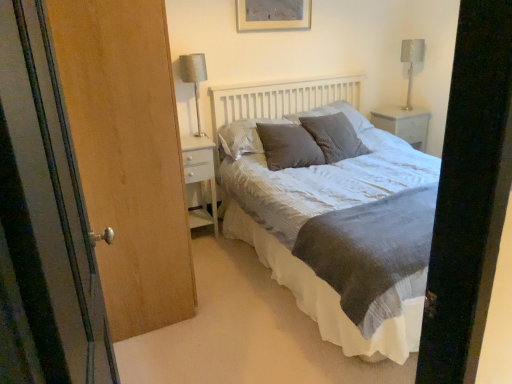
Identify the location of vacant area that is in front of white wood nightstand at left, the second nightstand viewed from the back. The height and width of the screenshot is (384, 512). (211, 255).